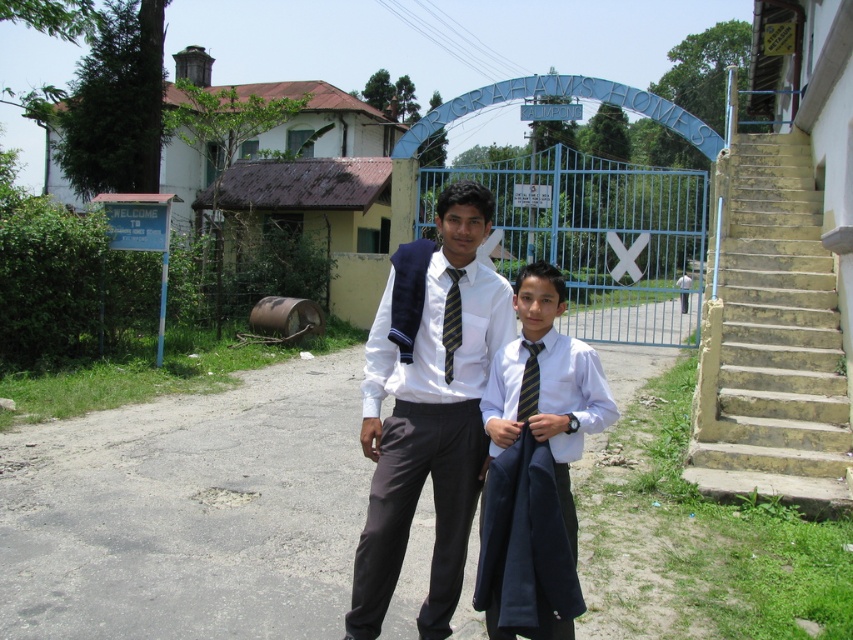
Question: Which point is closer to the camera?

Choices:
 (A) yellow concrete stairs at right
 (B) striped fabric tie at center

Answer: (B)

Question: Which object is positioned farthest from the yellow concrete stairs at right?

Choices:
 (A) yellow striped tie at center
 (B) matte white shirt at center
 (C) white shirt and tie at center
 (D) striped fabric tie at center

Answer: (A)

Question: Is yellow concrete stairs at right wider than striped fabric tie at center?

Choices:
 (A) no
 (B) yes

Answer: (B)

Question: Is yellow concrete stairs at right thinner than matte white shirt at center?

Choices:
 (A) yes
 (B) no

Answer: (A)

Question: Which object is positioned closest to the white shirt and tie at center?

Choices:
 (A) yellow concrete stairs at right
 (B) yellow striped tie at center
 (C) matte white shirt at center

Answer: (B)

Question: Can you confirm if yellow concrete stairs at right is bigger than striped fabric tie at center?

Choices:
 (A) yes
 (B) no

Answer: (A)